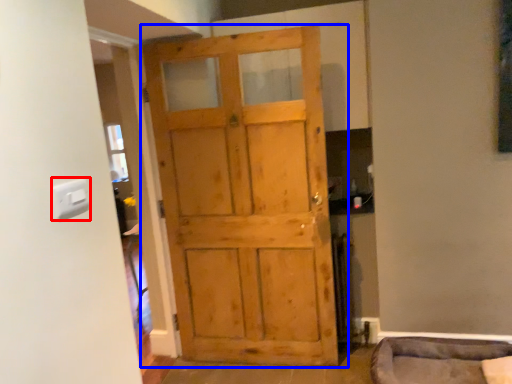
Question: Among these objects, which one is farthest to the camera, light switch (highlighted by a red box) or door (highlighted by a blue box)?

Choices:
 (A) light switch
 (B) door

Answer: (B)